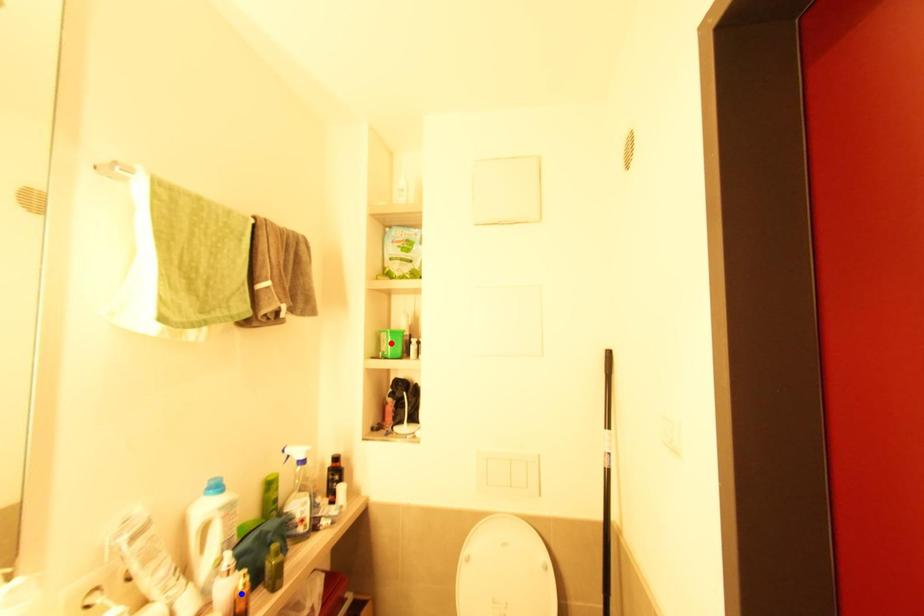
Question: Which of the two points in the image is closer to the camera?

Choices:
 (A) Blue point is closer.
 (B) Red point is closer.

Answer: (A)